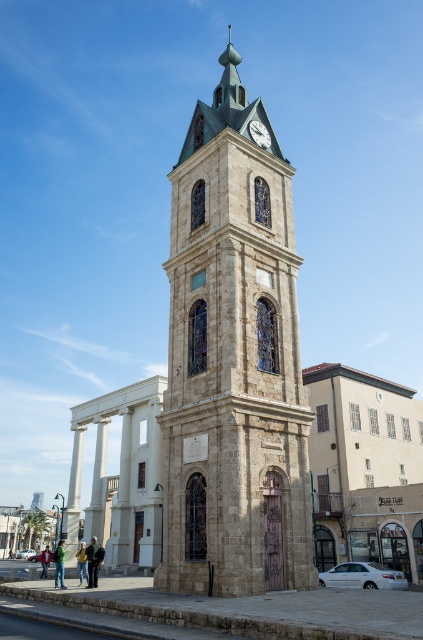
Question: Does white marble pillar at lower left lie behind white stone pillar at lower left?

Choices:
 (A) yes
 (B) no

Answer: (B)

Question: Which of these objects is positioned closest to the white marble pillar at lower left?

Choices:
 (A) white stone pillar at lower left
 (B) dark gray stone clock at upper center
 (C) stone clock tower at center

Answer: (A)

Question: Can you confirm if white marble pillar at lower left is positioned below dark gray stone clock at upper center?

Choices:
 (A) no
 (B) yes

Answer: (B)

Question: Which object is closer to the camera taking this photo?

Choices:
 (A) white stone pillar at lower left
 (B) dark gray stone clock at upper center

Answer: (B)

Question: Is white marble pillar at lower left bigger than white stone pillar at lower left?

Choices:
 (A) no
 (B) yes

Answer: (B)

Question: Which of the following is the closest to the observer?

Choices:
 (A) (76, 476)
 (B) (258, 141)

Answer: (B)